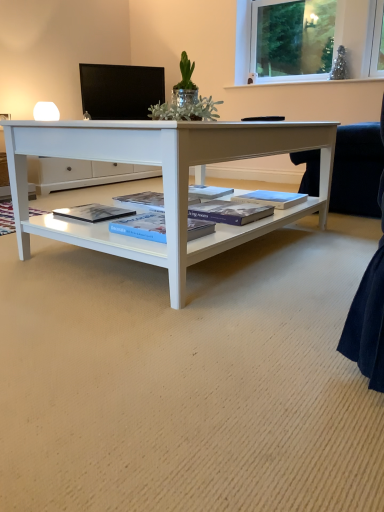
The height and width of the screenshot is (512, 384). Find the location of `vacant area on top of matte black book at center, which is the 1th magazine in left-to-right order (from a real-world perspective)`. vacant area on top of matte black book at center, which is the 1th magazine in left-to-right order (from a real-world perspective) is located at coordinates (98, 209).